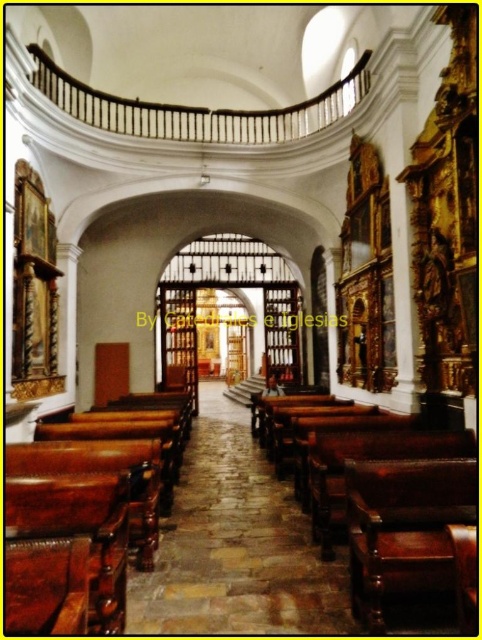
You are standing in the grand cathedral and need to find the brown leather bench at lower left. According to the 2D coordinates provided, where should you look to locate it?

The brown leather bench at lower left is located at the 2D coordinates point [80,518].

From the picture: You are standing at the entrance of the grand cathedral and notice two points marked in the scene. The first point is at coordinates point (156,538) and the second is at point (392,456). Which of these points is closer to the altar located at the far end of the church?

Point (156,538) is behind point (392,456), so it is closer to the altar located at the far end of the church.

You are a visitor in the church and want to sit down. You see the brown leather bench at lower left and the polished dark wood bench at center. Which bench can accommodate more people sitting side by side?

The polished dark wood bench at center can accommodate more people sitting side by side because it has a greater width than the brown leather bench at lower left.